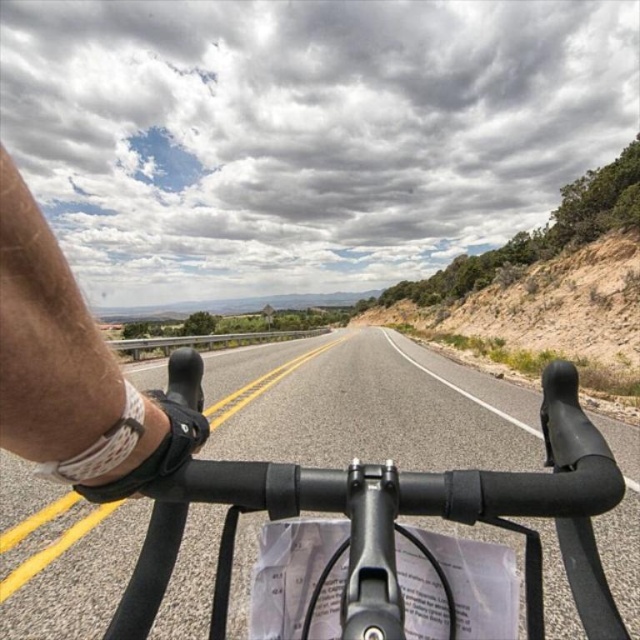
Can you confirm if black matte bicycle handlebars at center is shorter than skinny white bandage at left?

No.

The width and height of the screenshot is (640, 640). Find the location of `black matte bicycle handlebars at center`. black matte bicycle handlebars at center is located at coordinates (376, 406).